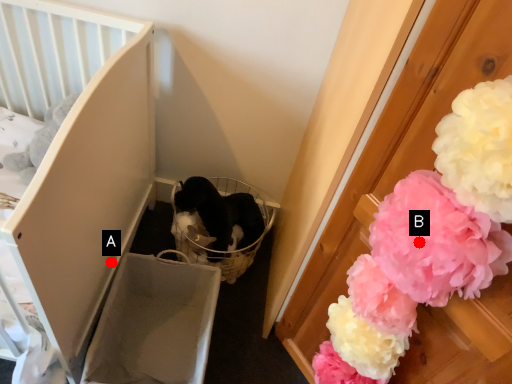
Question: Two points are circled on the image, labeled by A and B beside each circle. Which of the following is the closest to the observer?

Choices:
 (A) A is closer
 (B) B is closer

Answer: (B)